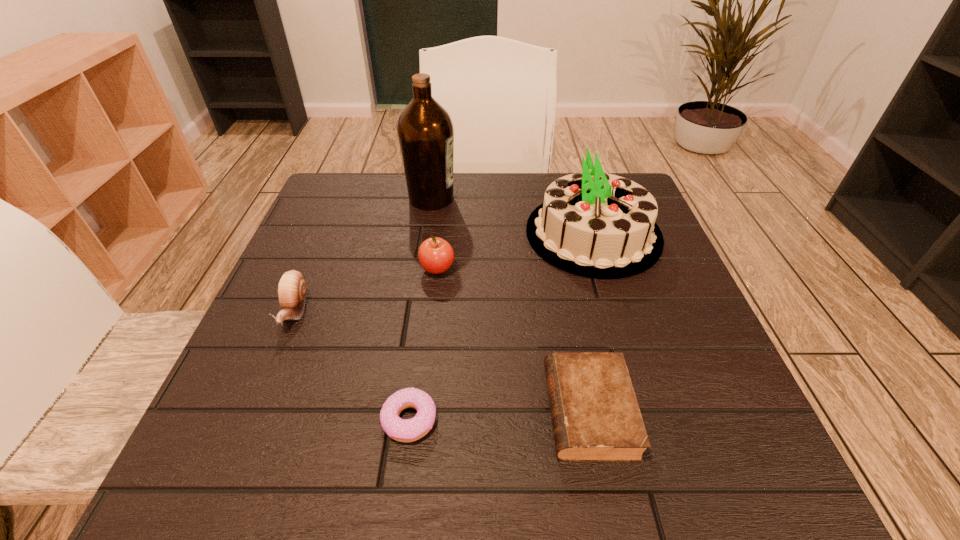
The height and width of the screenshot is (540, 960). Find the location of `olive oil`. olive oil is located at coordinates coord(425,130).

Image resolution: width=960 pixels, height=540 pixels. Find the location of `the second tallest object`. the second tallest object is located at coordinates (596, 225).

Image resolution: width=960 pixels, height=540 pixels. In order to click on the fourth shortest object in this screenshot , I will do `click(436, 255)`.

Locate an element on the screen. the leftmost object is located at coordinates (292, 287).

Locate an element on the screen. This screenshot has height=540, width=960. the fourth tallest object is located at coordinates (292, 287).

This screenshot has height=540, width=960. I want to click on the second shortest object, so click(x=595, y=416).

Where is `the shortest object`? the shortest object is located at coordinates (403, 430).

Find the location of a particular element. The width and height of the screenshot is (960, 540). vacant space located on the label of the olive oil is located at coordinates (609, 198).

The height and width of the screenshot is (540, 960). What are the coordinates of `vacant region located 0.060m on the back of the fifth shortest object` in the screenshot? It's located at (578, 185).

Locate an element on the screen. The width and height of the screenshot is (960, 540). vacant area located 0.190m on the left of the apple is located at coordinates point(327,269).